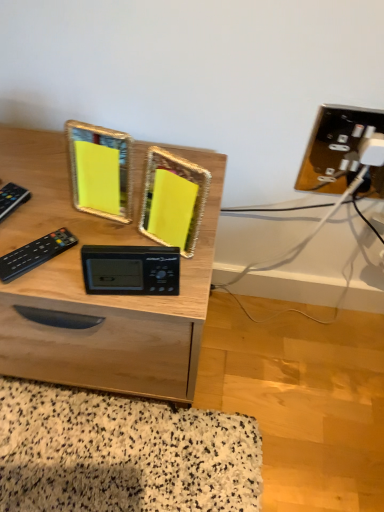
The width and height of the screenshot is (384, 512). Identify the location of free space above wooden desk at center (from a real-world perspective). [54, 210].